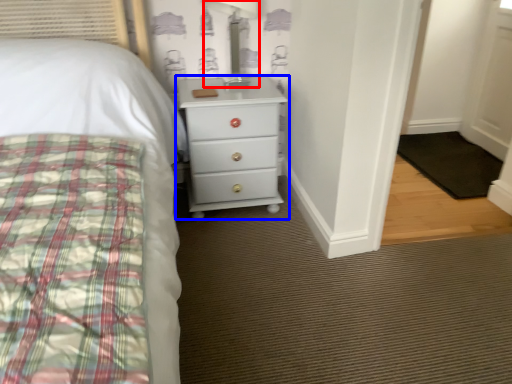
Question: Which point is closer to the camera, table lamp (highlighted by a red box) or chest of drawers (highlighted by a blue box)?

Choices:
 (A) table lamp
 (B) chest of drawers

Answer: (A)